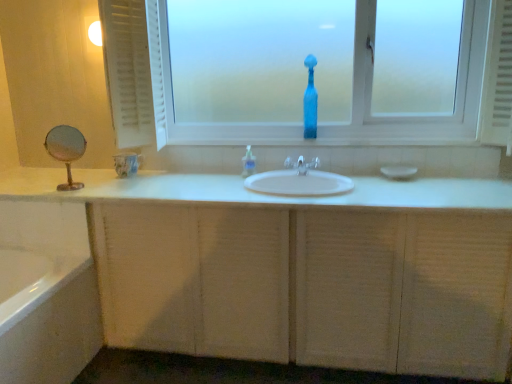
Locate an element on the screen. This screenshot has height=384, width=512. white matte curtain at left is located at coordinates (128, 71).

In the scene shown: Measure the distance between point (483, 110) and camera.

The distance of point (483, 110) from camera is 2.25 meters.

Measure the distance between white textured radiator at right and camera.

The depth of white textured radiator at right is 2.08 meters.

Where is `white textured cabinet at center`? Image resolution: width=512 pixels, height=384 pixels. white textured cabinet at center is located at coordinates (302, 269).

Find the location of a particular element. This screenshot has height=384, width=512. white matte soap at center is located at coordinates (399, 171).

Where is `white matte curtain at left`? The image size is (512, 384). white matte curtain at left is located at coordinates (128, 71).

Looking at this image, does white textured radiator at right turn towards transparent glass bottle at center?

No, white textured radiator at right does not turn towards transparent glass bottle at center.

Can you tell me how much white textured radiator at right and transparent glass bottle at center differ in facing direction?

There is a 2.24-degree angle between the facing directions of white textured radiator at right and transparent glass bottle at center.

Considering the relative sizes of white textured radiator at right and transparent glass bottle at center in the image provided, is white textured radiator at right smaller than transparent glass bottle at center?

Yes.

From the image's perspective, which one is positioned lower, white textured radiator at right or transparent glass bottle at center?

white textured radiator at right appears lower in the image.

Is white matte soap at center inside metallic reflective mirror at left?

No, white matte soap at center is not surrounded by metallic reflective mirror at left.

Is point (65, 126) positioned in front of point (381, 169)?

Yes, point (65, 126) is in front of point (381, 169).

Does metallic reflective mirror at left have a lesser width compared to white matte soap at center?

Indeed, metallic reflective mirror at left has a lesser width compared to white matte soap at center.

From the image's perspective, which is below, metallic reflective mirror at left or white matte soap at center?

white matte soap at center appears lower in the image.

Between white textured cabinet at center and clear plastic faucet at center, which one is positioned behind?

clear plastic faucet at center is more distant.

You are a GUI agent. You are given a task and a screenshot of the screen. Output one action in this format:
    pyautogui.click(x=<x>, y=<y>)
    Task: Click on the bathroom cabinet in front of the clear plastic faucet at center
    This screenshot has height=384, width=512.
    Given the screenshot: What is the action you would take?
    pyautogui.click(x=302, y=269)

Are white textured cabinet at center and clear plastic faucet at center far apart?

No.

Which of these two, translucent plastic soap dispenser at center or transparent glass bottle at center, is wider?

With larger width is transparent glass bottle at center.

Based on the photo, from a real-world perspective, is translucent plastic soap dispenser at center beneath transparent glass bottle at center?

Yes, from a real-world perspective, translucent plastic soap dispenser at center is beneath transparent glass bottle at center.

Considering the relative sizes of translucent plastic soap dispenser at center and transparent glass bottle at center in the image provided, is translucent plastic soap dispenser at center smaller than transparent glass bottle at center?

Yes, translucent plastic soap dispenser at center is smaller than transparent glass bottle at center.

From the image's perspective, is translucent plastic soap dispenser at center located above transparent glass bottle at center?

Actually, translucent plastic soap dispenser at center appears below transparent glass bottle at center in the image.

Would you say white textured cabinet at center is a long distance from translucent glass vase at center?

Absolutely, white textured cabinet at center is distant from translucent glass vase at center.

Is translucent glass vase at center inside white textured cabinet at center?

No.

Considering the positions of objects white textured cabinet at center and translucent glass vase at center in the image provided, who is behind, white textured cabinet at center or translucent glass vase at center?

translucent glass vase at center is further from the camera.

Consider the image. Which of these two, white textured cabinet at center or translucent glass vase at center, is smaller?

Smaller between the two is translucent glass vase at center.

Is white matte soap at center spatially inside metallic reflective mirror at left, or outside of it?

The correct answer is: outside.

Looking at the image, does white matte soap at center seem bigger or smaller compared to metallic reflective mirror at left?

Considering their sizes, white matte soap at center takes up less space than metallic reflective mirror at left.

Is white matte soap at center at the right side of metallic reflective mirror at left?

Indeed, white matte soap at center is positioned on the right side of metallic reflective mirror at left.

From the image's perspective, which is above, white matte soap at center or metallic reflective mirror at left?

metallic reflective mirror at left.

From a real-world perspective, between white matte soap at center and white textured radiator at right, who is vertically higher?

white textured radiator at right, from a real-world perspective.

Between white matte soap at center and white textured radiator at right, which one has smaller size?

With smaller size is white matte soap at center.

Looking at their sizes, would you say white matte soap at center is wider or thinner than white textured radiator at right?

white matte soap at center is thinner than white textured radiator at right.

Could you tell me if white matte soap at center is turned towards white textured radiator at right?

No, white matte soap at center does not turn towards white textured radiator at right.

This screenshot has height=384, width=512. What are the coordinates of `window above the white textured radiator at right (from the image's perspective)` in the screenshot? It's located at (412, 113).

Image resolution: width=512 pixels, height=384 pixels. In order to click on soap below the metallic reflective mirror at left (from the image's perspective) in this screenshot , I will do `click(399, 171)`.

From the image, which object appears to be farther from white textured radiator at right, translucent glass vase at center or white matte soap at center?

translucent glass vase at center lies further to white textured radiator at right than the other object.

Estimate the real-world distances between objects in this image. Which object is closer to white matte curtain at left, white textured radiator at right or transparent glass bottle at center?

The object closer to white matte curtain at left is transparent glass bottle at center.

Which object lies further to the anchor point translucent glass vase at center, white textured radiator at right or white matte soap at center?

Based on the image, white textured radiator at right appears to be further to translucent glass vase at center.

When comparing their distances from white textured radiator at right, does white matte curtain at left or white matte soap at center seem closer?

Among the two, white matte soap at center is located nearer to white textured radiator at right.

From the image, which object appears to be farther from white textured cabinet at center, translucent glass vase at center or translucent plastic soap dispenser at center?

translucent glass vase at center is positioned further to the anchor white textured cabinet at center.

Estimate the real-world distances between objects in this image. Which object is further from metallic reflective mirror at left, translucent glass vase at center or white matte curtain at left?

white matte curtain at left.

Looking at the image, which one is located further to white textured cabinet at center, metallic reflective mirror at left or transparent glass bottle at center?

metallic reflective mirror at left is positioned further to the anchor white textured cabinet at center.

When comparing their distances from translucent plastic soap dispenser at center, does white textured cabinet at center or metallic reflective mirror at left seem closer?

Among the two, white textured cabinet at center is located nearer to translucent plastic soap dispenser at center.

This screenshot has height=384, width=512. I want to click on curtain between transparent glass bottle at center and white textured cabinet at center from top to bottom, so click(x=128, y=71).

What are the coordinates of `glass vase situated between metallic reflective mirror at left and white textured cabinet at center from left to right` in the screenshot? It's located at (126, 164).

Find the location of a particular element. The image size is (512, 384). curtain between translucent glass vase at center and clear plastic faucet at center in the horizontal direction is located at coordinates (128, 71).

Image resolution: width=512 pixels, height=384 pixels. Identify the location of soap between transparent glass bottle at center and white textured cabinet at center vertically. (399, 171).